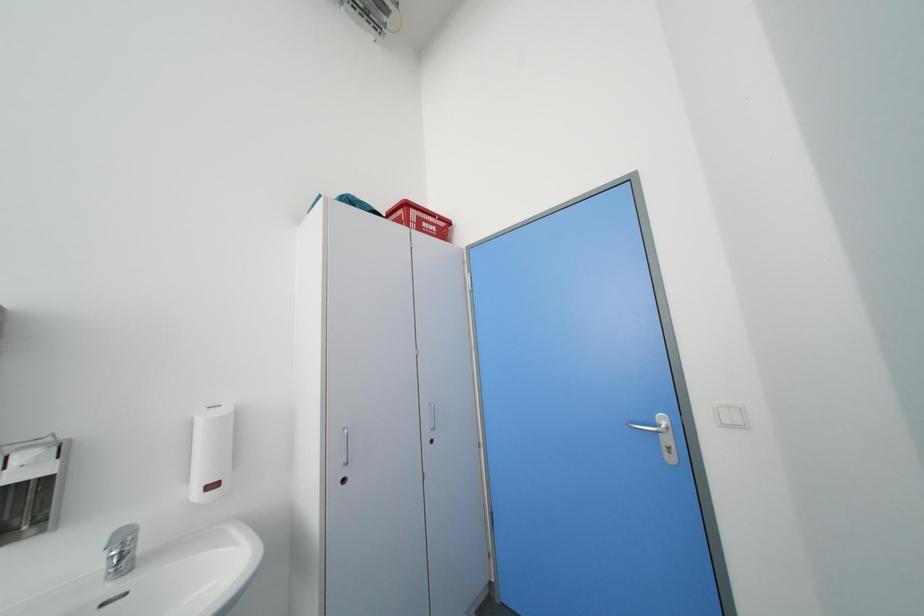
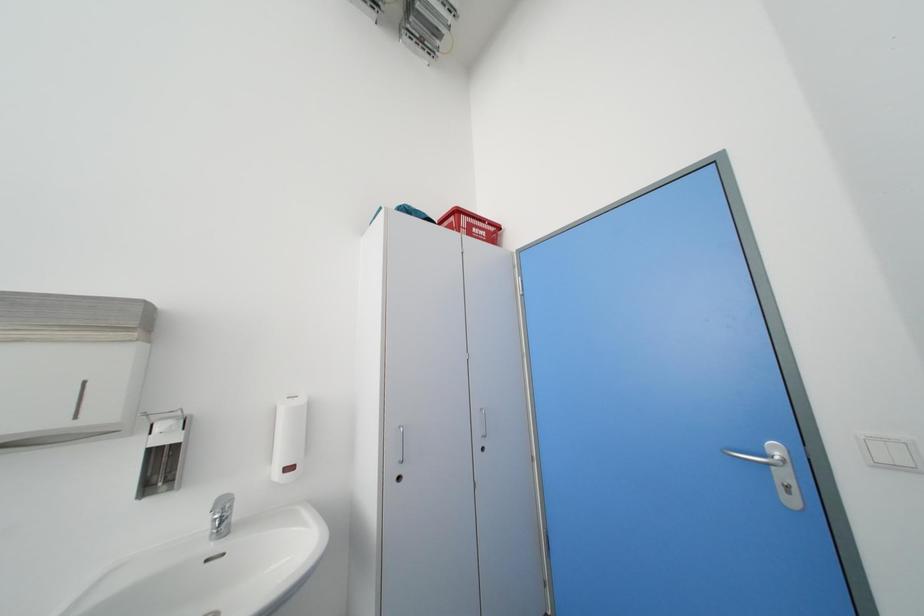
Question: Based on the continuous images, in which direction is the camera rotating? Reply with the corresponding letter.

Choices:
 (A) Left
 (B) Right
 (C) Up
 (D) Down

Answer: (A)